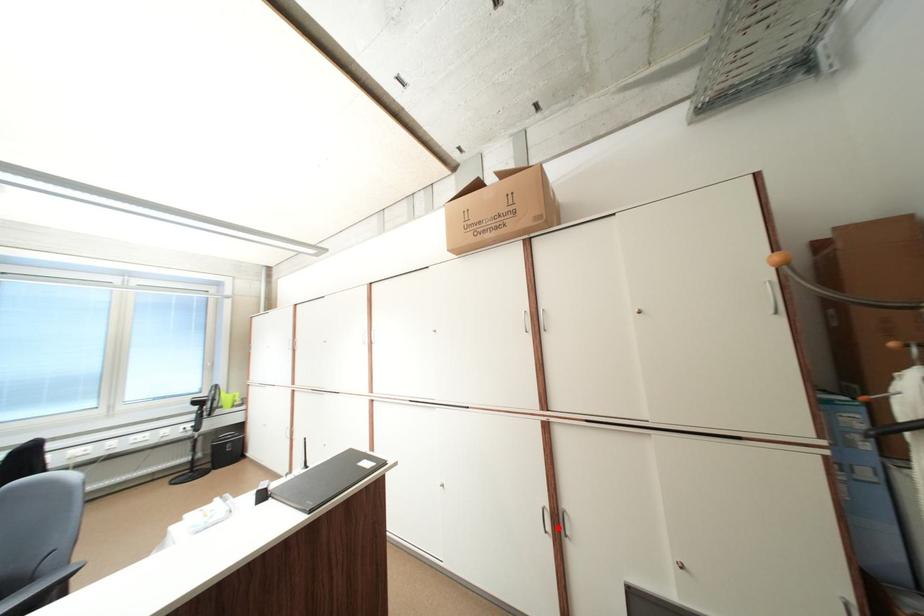
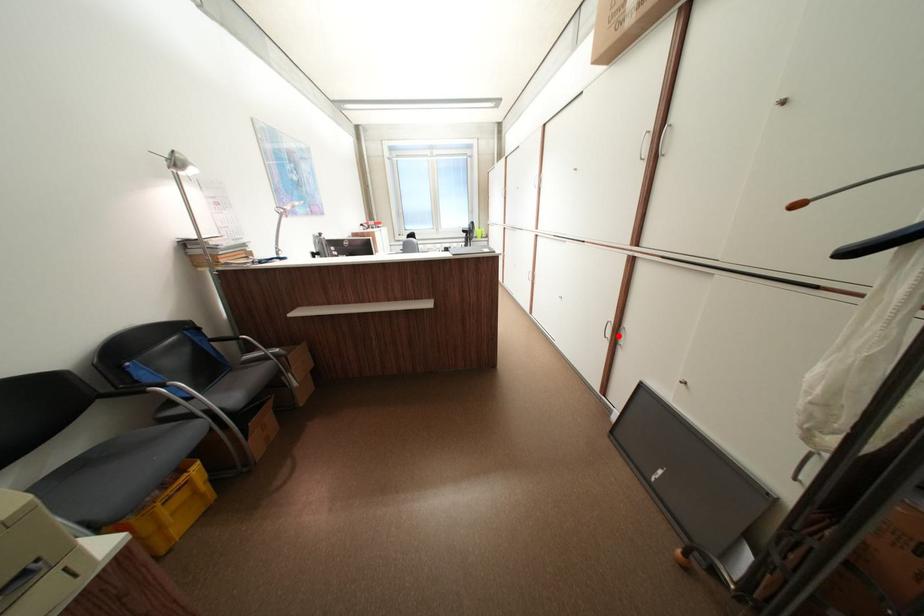
I am providing you with two images of the same scene from different viewpoints. A red point is marked on the first image and another point is marked on the second image. Is the red point in image1 aligned with the point shown in image2?

Yes